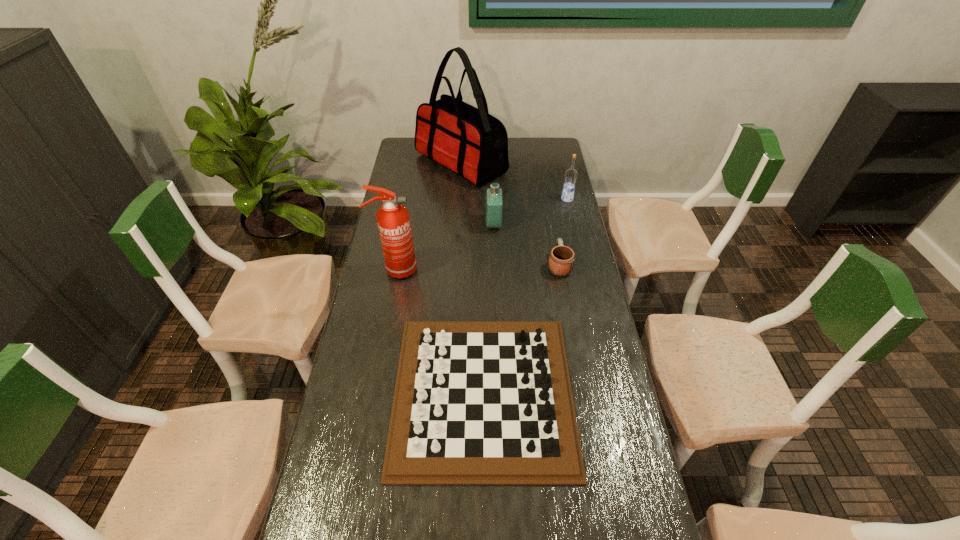
At what (x,y) coordinates should I click in order to perform the action: click on vacant space located 0.150m on the left of the vodka. Please return your answer as a coordinate pair (x, y). The image size is (960, 540). Looking at the image, I should click on (526, 199).

I want to click on free space located on the front label of the perfume, so click(408, 225).

Image resolution: width=960 pixels, height=540 pixels. What are the coordinates of `free region located 0.310m on the front label of the perfume` in the screenshot? It's located at (408, 225).

This screenshot has width=960, height=540. What are the coordinates of `vacant space located on the front label of the perfume` in the screenshot? It's located at (448, 225).

This screenshot has height=540, width=960. What are the coordinates of `free point located on the left of the nearest object` in the screenshot? It's located at (373, 393).

Identify the location of free spot located on the side of the mug with the handle. (549, 210).

This screenshot has height=540, width=960. What are the coordinates of `vacant space located on the side of the mug with the handle` in the screenshot? It's located at (547, 197).

You are a GUI agent. You are given a task and a screenshot of the screen. Output one action in this format:
    pyautogui.click(x=<x>, y=<y>)
    Task: Click on the free space located 0.070m on the side of the mug with the handle
    The image size is (960, 540).
    Given the screenshot: What is the action you would take?
    pyautogui.click(x=555, y=240)

At what (x,y) coordinates should I click in order to perform the action: click on object that is at the far edge. Please return your answer as a coordinate pair (x, y). This screenshot has width=960, height=540. Looking at the image, I should click on (469, 141).

Find the location of a particular element. duffel bag located in the left edge section of the desktop is located at coordinates (469, 141).